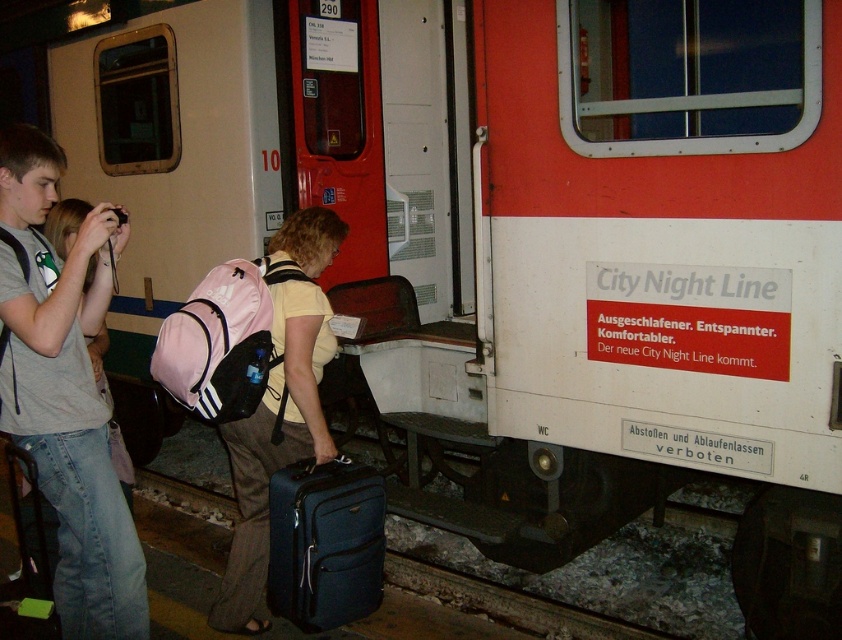
Does matte pink backpack at center have a smaller size compared to matte blue suitcase at lower center?

Actually, matte pink backpack at center might be larger than matte blue suitcase at lower center.

Which of these two, matte pink backpack at center or matte blue suitcase at lower center, stands taller?

matte pink backpack at center

Identify the location of matte pink backpack at center. (276, 410).

Where is `gray cotton t-shirt at left`? gray cotton t-shirt at left is located at coordinates [x=65, y=392].

Can you confirm if gray cotton t-shirt at left is positioned to the right of matte pink backpack at center?

In fact, gray cotton t-shirt at left is to the left of matte pink backpack at center.

Who is more distant from viewer, (43, 140) or (318, 368)?

The point (318, 368) is behind.

I want to click on gray cotton t-shirt at left, so click(65, 392).

Can you confirm if gray cotton t-shirt at left is positioned to the right of matte blue suitcase at lower center?

In fact, gray cotton t-shirt at left is to the left of matte blue suitcase at lower center.

Which is more to the right, gray cotton t-shirt at left or matte blue suitcase at lower center?

matte blue suitcase at lower center

Who is more distant from viewer, (102, 224) or (360, 604)?

Point (360, 604)

This screenshot has width=842, height=640. I want to click on gray cotton t-shirt at left, so click(65, 392).